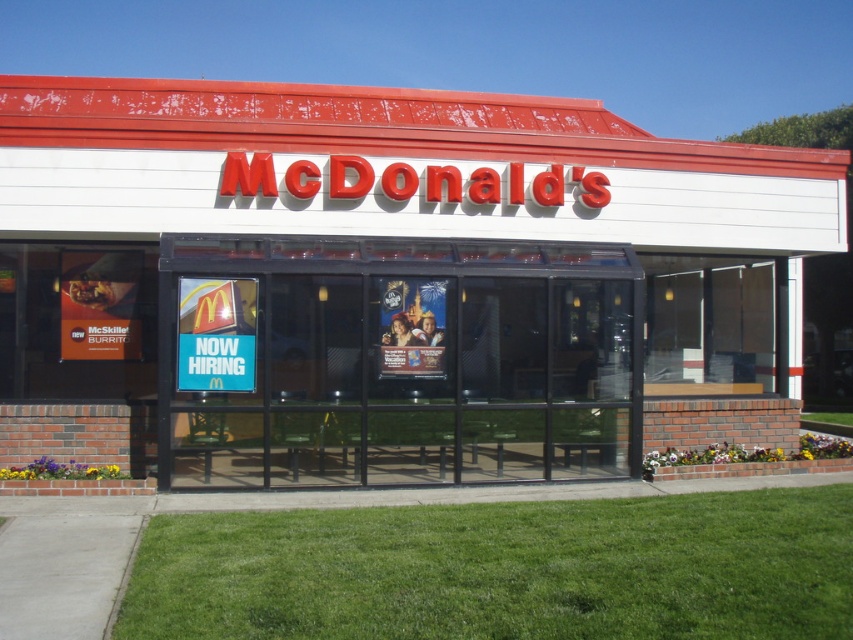
Between white brick mcdonald's at center and transparent glass bench at center, which one appears on the left side from the viewer's perspective?

Positioned to the left is transparent glass bench at center.

Can you confirm if white brick mcdonald's at center is bigger than transparent glass bench at center?

Yes.

I want to click on white brick mcdonald's at center, so click(x=387, y=282).

Locate an element on the screen. The height and width of the screenshot is (640, 853). white brick mcdonald's at center is located at coordinates (387, 282).